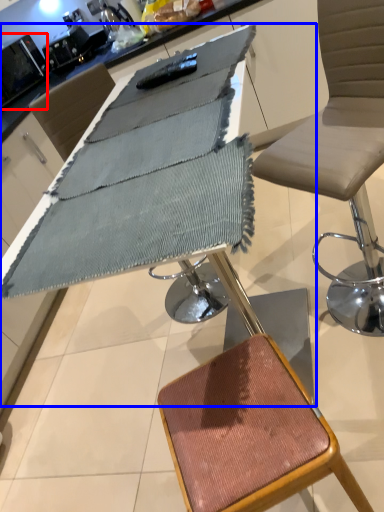
Question: Which point is closer to the camera, appliance (highlighted by a red box) or table (highlighted by a blue box)?

Choices:
 (A) appliance
 (B) table

Answer: (B)